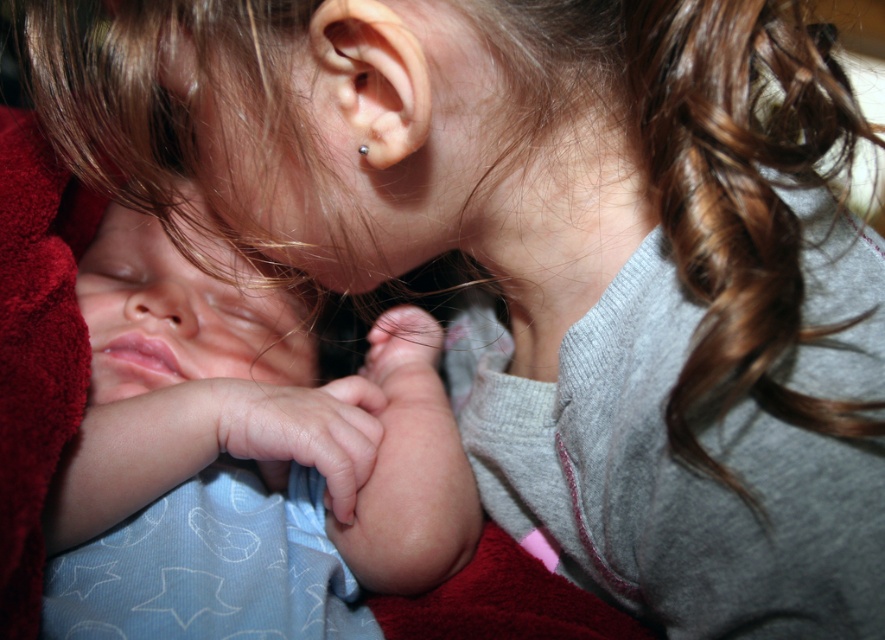
Question: Observing the image, what is the correct spatial positioning of smooth blue fabric at left in reference to silver metallic earring at ear?

Choices:
 (A) below
 (B) above

Answer: (A)

Question: Is smooth blue fabric at left below smooth silver earring at upper center?

Choices:
 (A) yes
 (B) no

Answer: (A)

Question: Among these points, which one is nearest to the camera?

Choices:
 (A) (406, 74)
 (B) (431, 579)
 (C) (367, 150)

Answer: (A)

Question: Which object is the farthest from the smooth blue fabric at left?

Choices:
 (A) smooth silver earring at upper center
 (B) silver metallic earring at ear

Answer: (B)

Question: Which of the following is the closest to the observer?

Choices:
 (A) click(360, 152)
 (B) click(354, 64)

Answer: (B)

Question: Is smooth blue fabric at left bigger than silver metallic earring at ear?

Choices:
 (A) yes
 (B) no

Answer: (A)